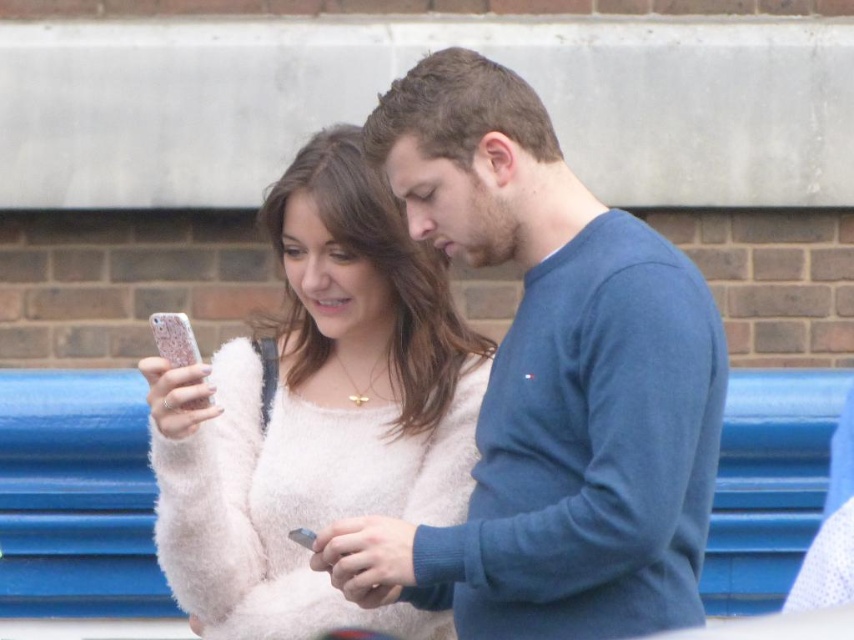
Question: Which point is closer to the camera?

Choices:
 (A) (424, 448)
 (B) (366, 528)

Answer: (B)

Question: Is blue cotton sweater at center further to the viewer compared to fuzzy white sweater at center?

Choices:
 (A) yes
 (B) no

Answer: (B)

Question: Is blue cotton sweater at center positioned at the back of fuzzy white sweater at center?

Choices:
 (A) yes
 (B) no

Answer: (B)

Question: Does blue cotton sweater at center have a smaller size compared to fuzzy white sweater at center?

Choices:
 (A) no
 (B) yes

Answer: (B)